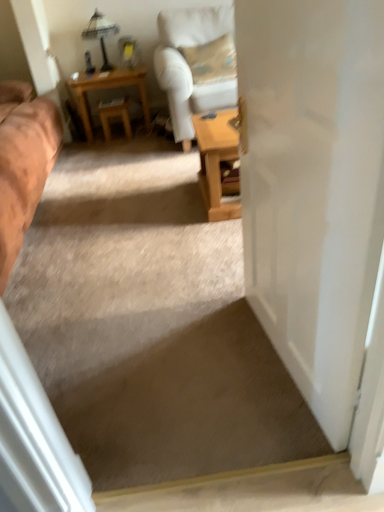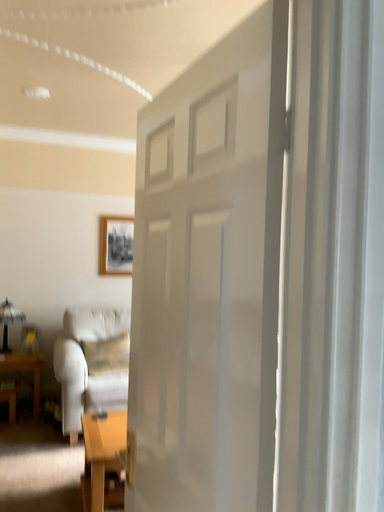
Question: How did the camera likely rotate when shooting the video?

Choices:
 (A) rotated downward
 (B) rotated upward

Answer: (B)